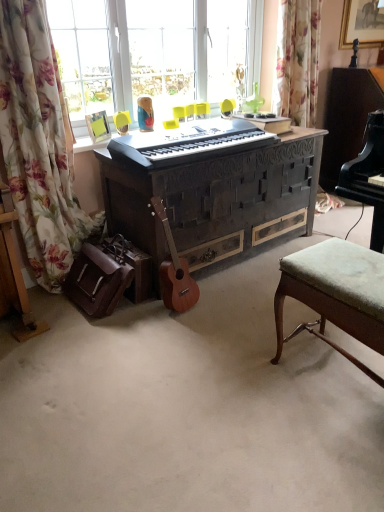
Find the location of a particular element. The image size is (384, 512). free space in front of green fabric stool at lower right is located at coordinates (326, 460).